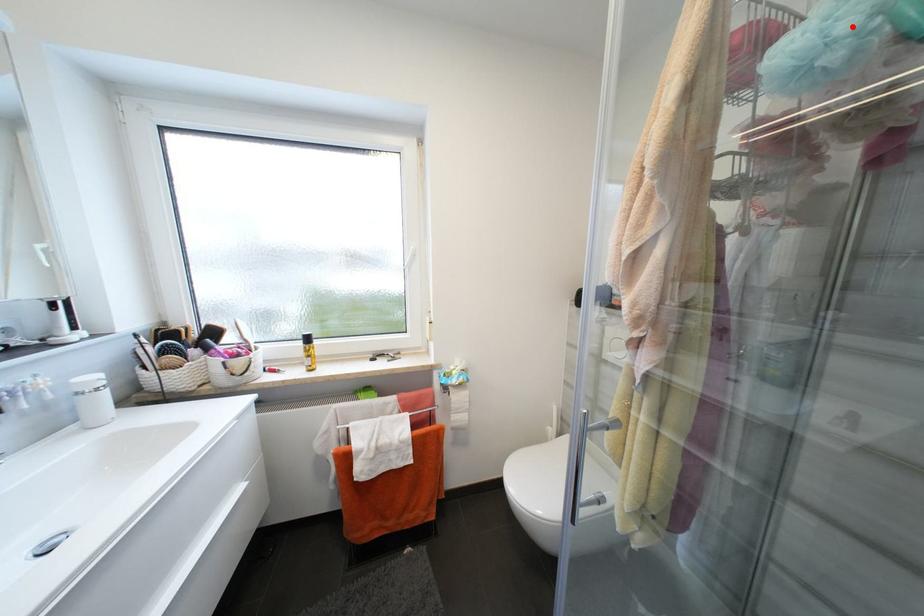
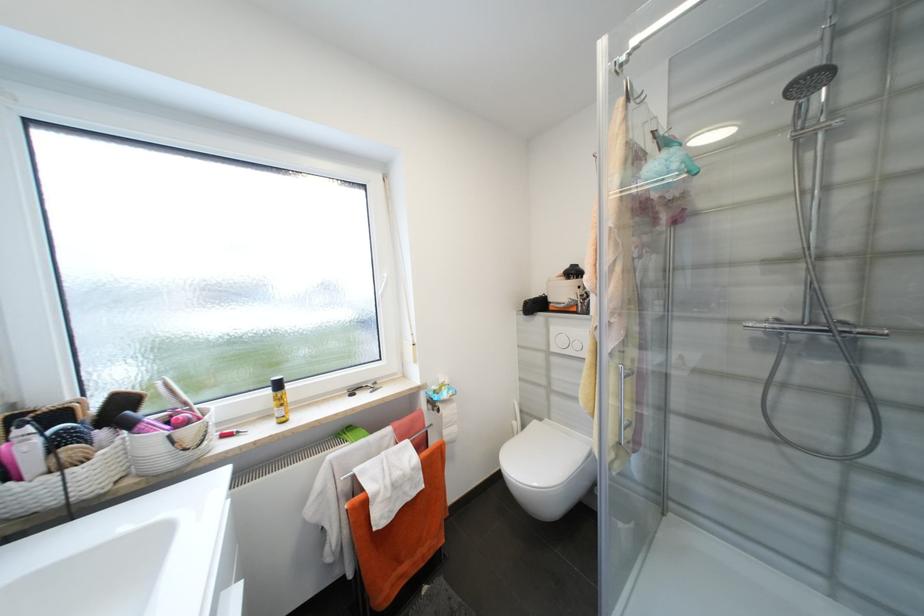
Locate, in the second image, the point that corresponds to the highlighted location in the first image.

(681, 167)